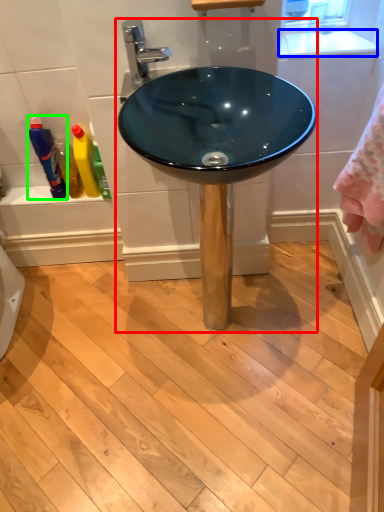
Question: Based on their relative distances, which object is farther from sink (highlighted by a red box)? Choose from counter top (highlighted by a blue box) and bottle (highlighted by a green box).

Choices:
 (A) counter top
 (B) bottle

Answer: (B)